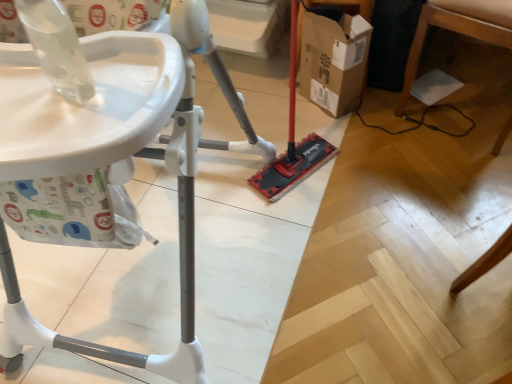
I want to click on free space in front of cardboard box at center, so click(338, 141).